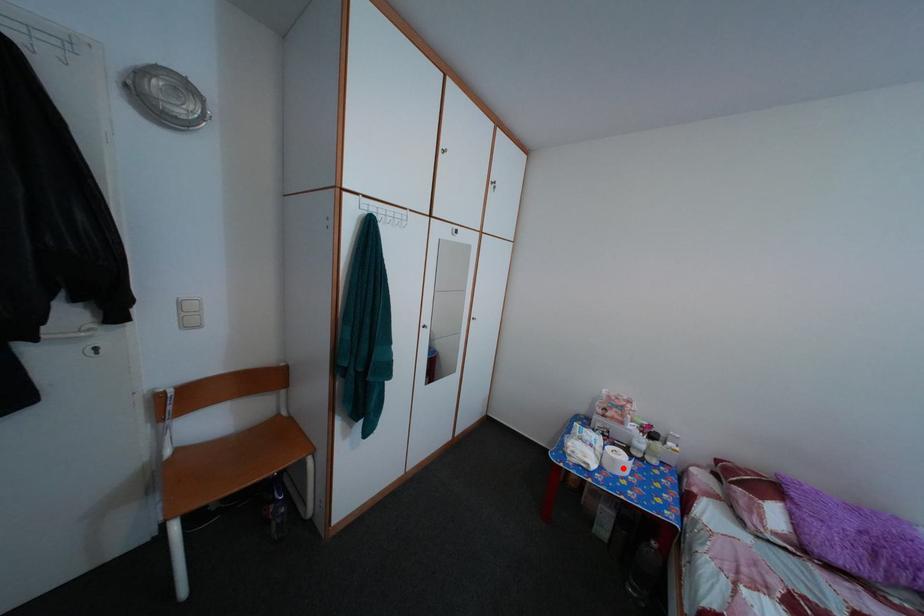
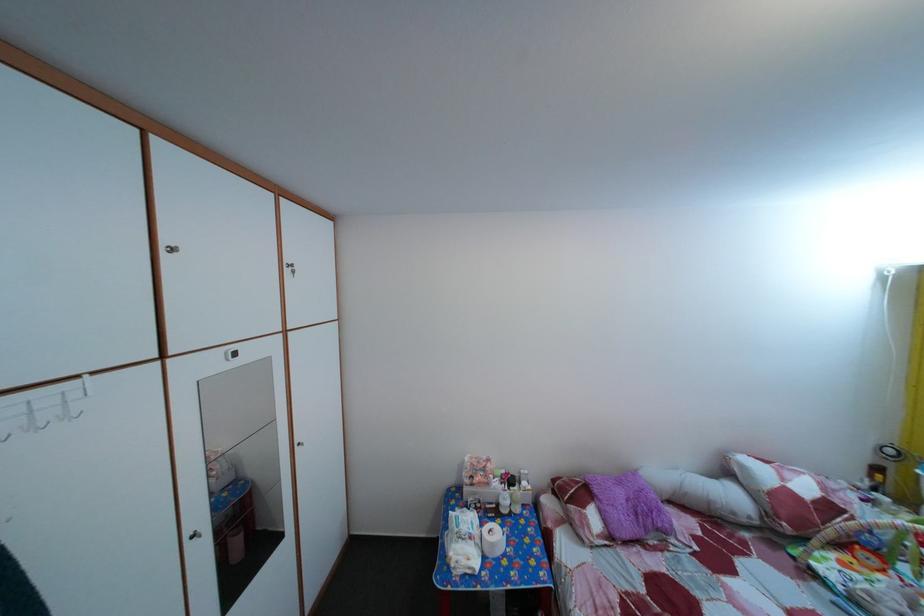
Find the pixel in the second image that matches the highlighted location in the first image.

(502, 553)